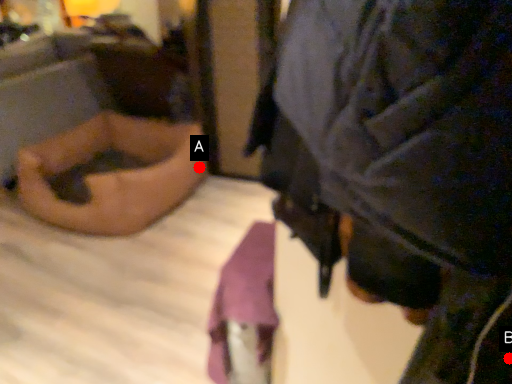
Question: Two points are circled on the image, labeled by A and B beside each circle. Which point appears farthest from the camera in this image?

Choices:
 (A) A is further
 (B) B is further

Answer: (A)